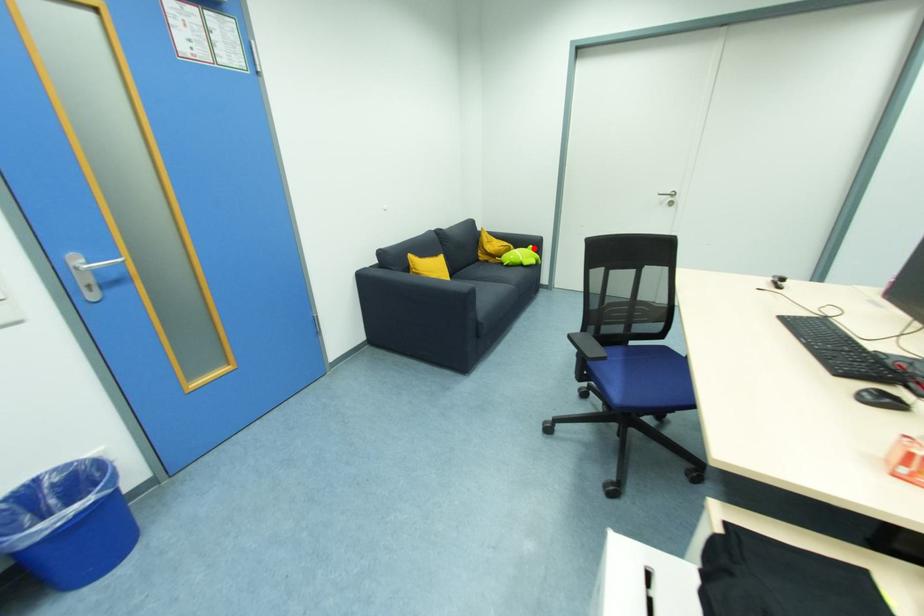
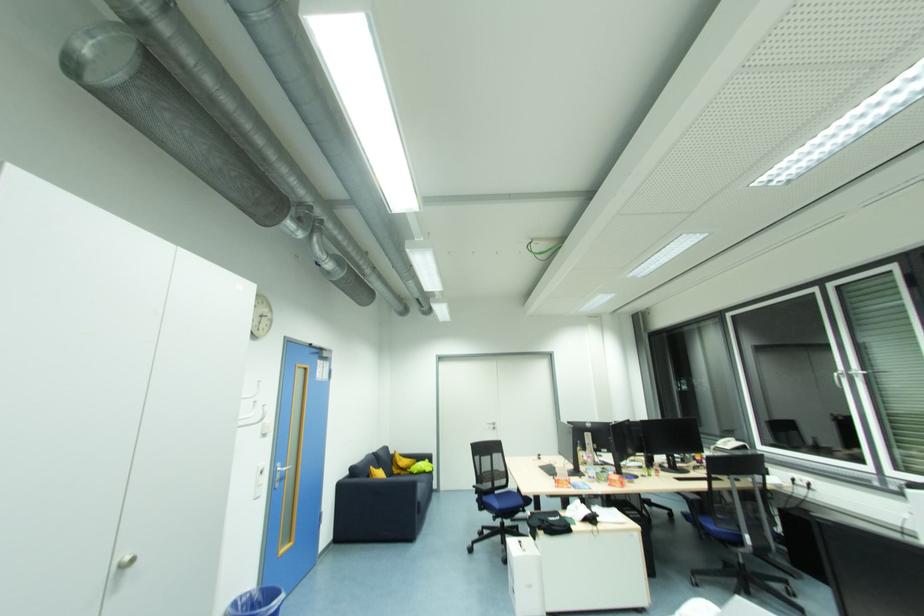
Question: A red point is marked in image1. In image2, is the corresponding 3D point closer to the camera or farther? Reply with the corresponding letter.

Choices:
 (A) The corresponding 3D point is closer.
 (B) The corresponding 3D point is farther.

Answer: (B)